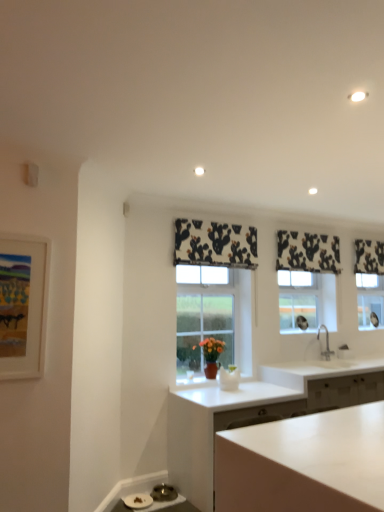
Question: In the image, is matte white picture frame at left positioned in front of or behind white matte cabinet at center?

Choices:
 (A) behind
 (B) front

Answer: (B)

Question: Is matte white picture frame at left taller or shorter than white matte cabinet at center?

Choices:
 (A) tall
 (B) short

Answer: (A)

Question: Which is farther from the black and white fabric at upper right, placed as the first curtain when sorted from back to front?

Choices:
 (A) matte white picture frame at left
 (B) black printed fabric at upper center, arranged as the third curtain when viewed from the right
 (C) black printed fabric at upper center, the second curtain positioned from the back
 (D) silver metallic faucet at right
 (E) white matte cabinet at center

Answer: (A)

Question: Which object is positioned closest to the black and white fabric at upper right, the third curtain viewed from the left?

Choices:
 (A) white glossy countertop at lower right
 (B) silver metallic faucet at right
 (C) black printed fabric at upper center, which is the 1th curtain from left to right
 (D) white matte cabinet at center
 (E) black printed fabric at upper center, the second curtain positioned from the front

Answer: (E)